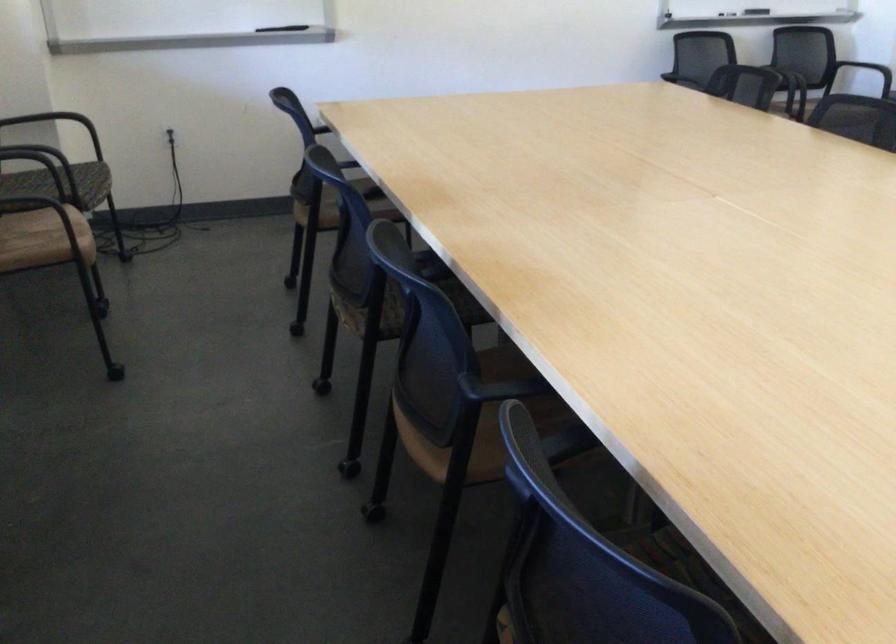
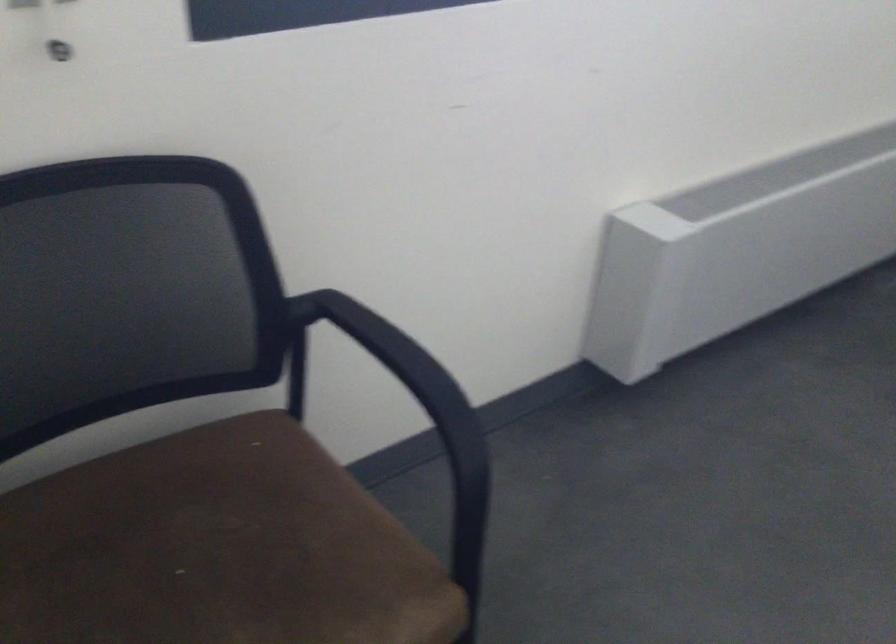
Looking at this image, the first image is from the beginning of the video and the second image is from the end. How did the camera likely rotate when shooting the video?

The rotation direction of the camera is left-down.